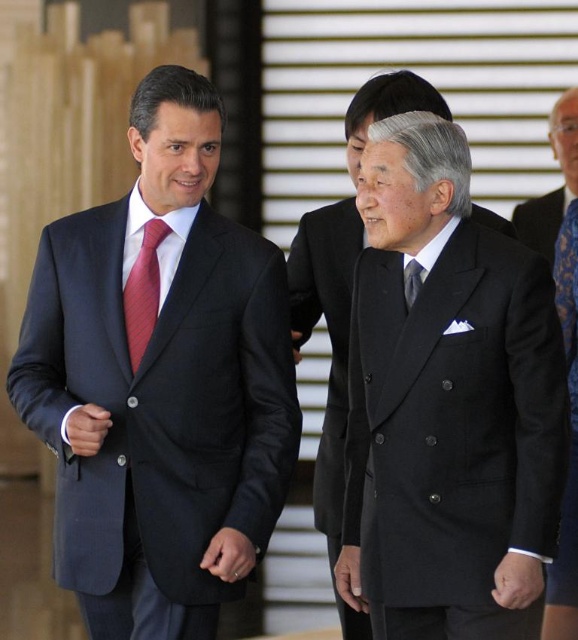
Question: Does black silk suit at center appear on the right side of silky black tie at center?

Choices:
 (A) no
 (B) yes

Answer: (A)

Question: Does black silk suit at center have a lesser width compared to black wool suit at center?

Choices:
 (A) yes
 (B) no

Answer: (B)

Question: Considering the real-world distances, which object is farthest from the blue lace dress at right?

Choices:
 (A) black wool suit at center
 (B) dark blue suit at right
 (C) striped silk tie at left
 (D) black silk suit at center

Answer: (B)

Question: Does blue lace dress at right appear on the left side of striped silk tie at left?

Choices:
 (A) yes
 (B) no

Answer: (B)

Question: Which object appears closest to the camera in this image?

Choices:
 (A) dark blue suit at right
 (B) black wool suit at center
 (C) black woolen suit at center
 (D) matte black suit at left

Answer: (C)

Question: Which point is closer to the camera taking this photo?

Choices:
 (A) (576, 580)
 (B) (379, 625)

Answer: (B)